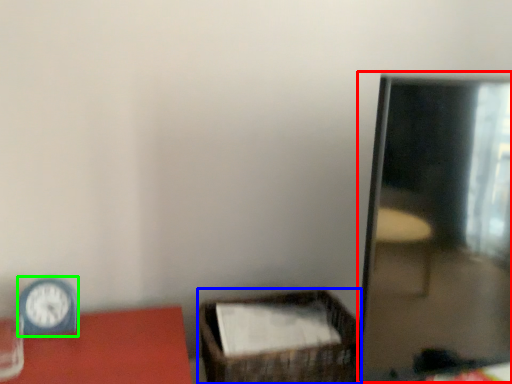
Question: Which is farther away from mirror (highlighted by a red box)? basket (highlighted by a blue box) or clock (highlighted by a green box)?

Choices:
 (A) basket
 (B) clock

Answer: (B)